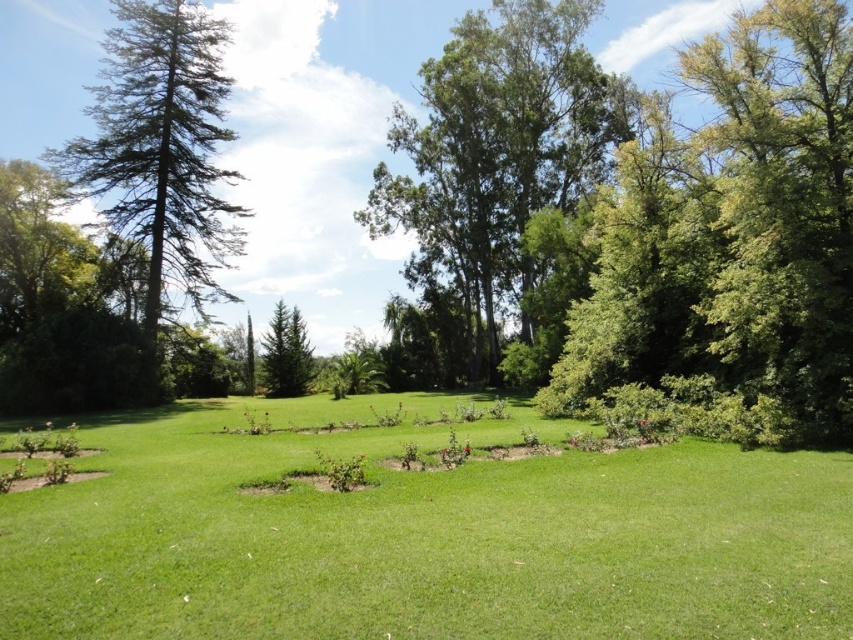
Question: Which object is farther from the camera taking this photo?

Choices:
 (A) green grassy at center
 (B) green needle-like tree at center
 (C) green leafy tree at right
 (D) green needle-like at left

Answer: (B)

Question: Where is green grassy at center located in relation to green needle-like at left in the image?

Choices:
 (A) below
 (B) above

Answer: (A)

Question: Which object is positioned closest to the green needle-like tree at center?

Choices:
 (A) green grassy at center
 (B) green leafy tree at right
 (C) green leafy tree at center
 (D) green needle-like at left

Answer: (D)

Question: Which is nearer to the green grassy at center?

Choices:
 (A) green needle-like tree at center
 (B) green leafy tree at right

Answer: (B)

Question: Does green needle-like at left appear over green needle-like tree at center?

Choices:
 (A) yes
 (B) no

Answer: (A)

Question: Is green leafy tree at center positioned behind green needle-like at left?

Choices:
 (A) no
 (B) yes

Answer: (A)